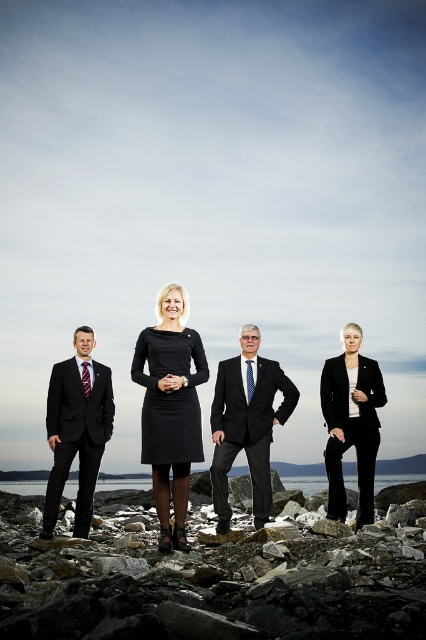
Is rough stone at center taller than matte black suit at left?

In fact, rough stone at center may be shorter than matte black suit at left.

Is point (279, 576) positioned in front of point (89, 476)?

Yes, it is.

Where is `rough stone at center`? This screenshot has height=640, width=426. rough stone at center is located at coordinates pyautogui.click(x=207, y=579).

Between point (325, 401) and point (6, 483), which one is positioned in front?

Point (325, 401) is more forward.

Who is positioned more to the left, black matte blazer at right or transparent water at center?

transparent water at center is more to the left.

This screenshot has width=426, height=640. Find the location of `black matte blazer at right`. black matte blazer at right is located at coordinates pos(351,433).

Which is more to the left, black matte suit at center or transparent water at center?

From the viewer's perspective, black matte suit at center appears more on the left side.

Between point (193, 419) and point (25, 493), which one is positioned in front?

Point (193, 419) is in front.

Is point (161, 497) in front of point (296, 477)?

Yes, point (161, 497) is closer to viewer.

Find the location of `black matte suit at center`. black matte suit at center is located at coordinates (170, 406).